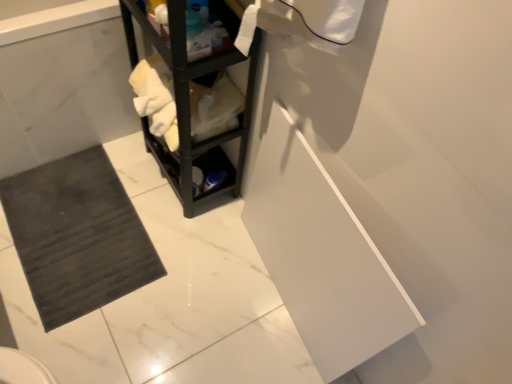
Question: From a real-world perspective, is black matte shelf at center beneath dark gray rubber bath mat at lower left?

Choices:
 (A) yes
 (B) no

Answer: (B)

Question: Is dark gray rubber bath mat at lower left at the back of black matte shelf at center?

Choices:
 (A) yes
 (B) no

Answer: (B)

Question: Does black matte shelf at center have a larger size compared to dark gray rubber bath mat at lower left?

Choices:
 (A) no
 (B) yes

Answer: (B)

Question: Can you confirm if black matte shelf at center is smaller than dark gray rubber bath mat at lower left?

Choices:
 (A) no
 (B) yes

Answer: (A)

Question: From the image's perspective, is black matte shelf at center on dark gray rubber bath mat at lower left?

Choices:
 (A) yes
 (B) no

Answer: (B)

Question: Is black matte shelf at center to the left of dark gray rubber bath mat at lower left from the viewer's perspective?

Choices:
 (A) yes
 (B) no

Answer: (B)

Question: Considering the relative sizes of dark gray rubber bath mat at lower left and black matte shelf at center in the image provided, is dark gray rubber bath mat at lower left wider than black matte shelf at center?

Choices:
 (A) yes
 (B) no

Answer: (B)

Question: Can you confirm if dark gray rubber bath mat at lower left is bigger than black matte shelf at center?

Choices:
 (A) no
 (B) yes

Answer: (A)

Question: Can you confirm if dark gray rubber bath mat at lower left is thinner than black matte shelf at center?

Choices:
 (A) yes
 (B) no

Answer: (A)

Question: Is dark gray rubber bath mat at lower left to the left of black matte shelf at center from the viewer's perspective?

Choices:
 (A) no
 (B) yes

Answer: (B)

Question: From the image's perspective, is dark gray rubber bath mat at lower left below black matte shelf at center?

Choices:
 (A) no
 (B) yes

Answer: (A)

Question: From a real-world perspective, is dark gray rubber bath mat at lower left positioned over black matte shelf at center based on gravity?

Choices:
 (A) yes
 (B) no

Answer: (B)

Question: Would you consider black matte shelf at center to be distant from dark gray rubber bath mat at lower left?

Choices:
 (A) no
 (B) yes

Answer: (A)